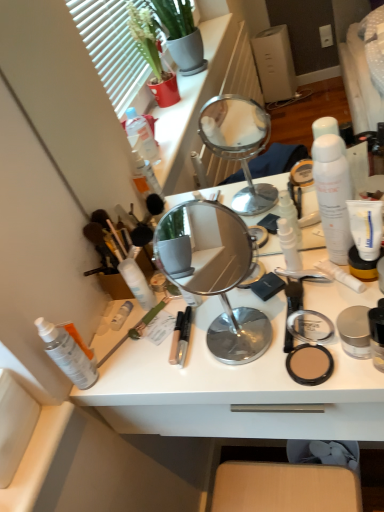
What are the coordinates of `free location in front of white matte spray can at center, which is the fourth toiletry in left-to-right order` in the screenshot? It's located at (175, 353).